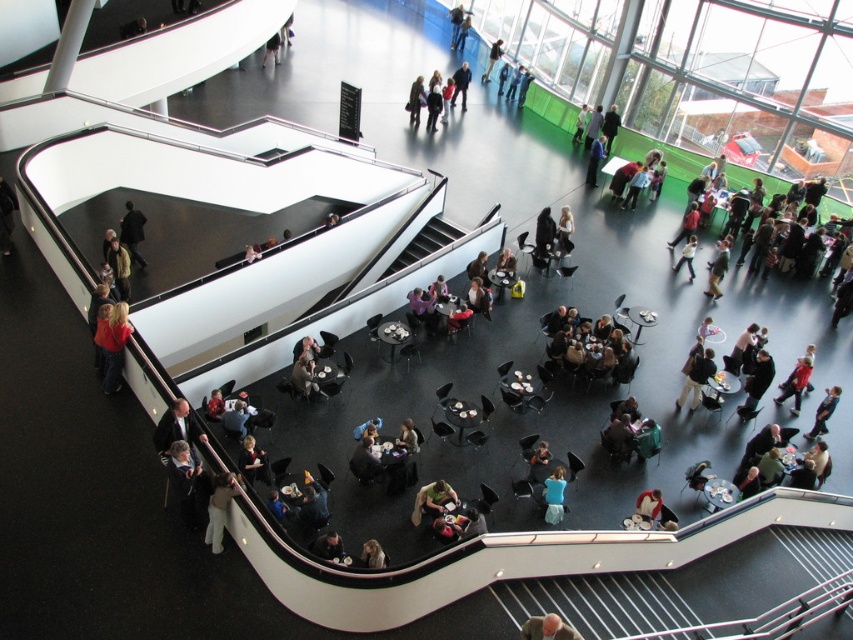
In the scene shown: You are designing a seating arrangement for a small event and need to place two items in the venue. You have a gray hair at lower center and a dark gray jacket at upper left. Based on their sizes, which item requires more space horizontally?

The dark gray jacket at upper left requires more horizontal space since its width is greater than the gray hair at lower center.

You are standing at point (143,218) and want to walk to the exit located at point (526,620). Is the exit in front of you or behind you?

The exit at point (526,620) is in front of you because it is in front of point (143,218) where you are standing.

You are standing at the entrance of the venue and see the dark gray jacket at upper left and the light brown leather jacket at center. Which jacket is positioned more to the left side of the venue?

The dark gray jacket at upper left is positioned more to the left side of the venue because it is to the left of the light brown leather jacket at center.